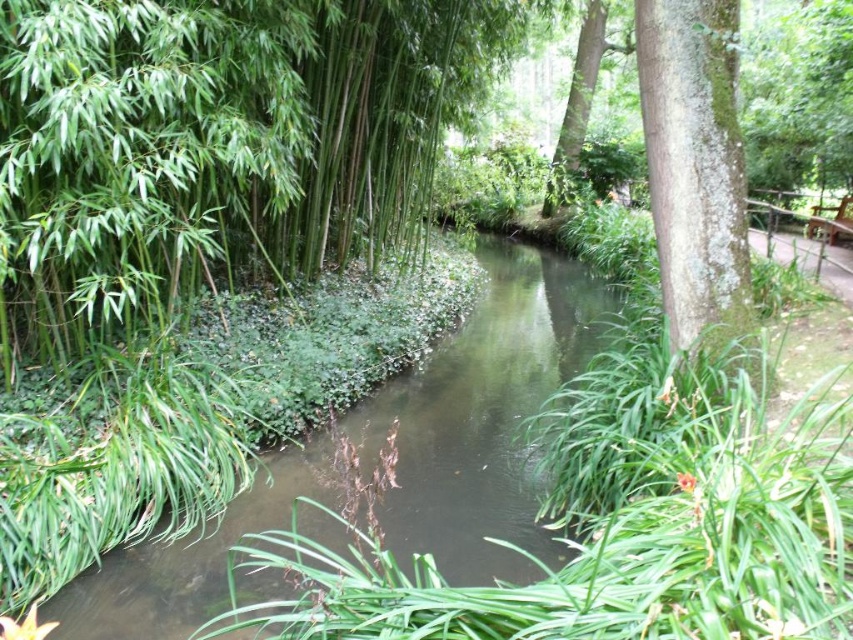
Between point (424, 140) and point (548, 186), which one is positioned in front?

Point (424, 140) is in front.

Which is more to the right, green bamboo at left or green leafy tree at upper center?

From the viewer's perspective, green leafy tree at upper center appears more on the right side.

This screenshot has height=640, width=853. Describe the element at coordinates (216, 145) in the screenshot. I see `green bamboo at left` at that location.

You are a GUI agent. You are given a task and a screenshot of the screen. Output one action in this format:
    pyautogui.click(x=<x>, y=<y>)
    Task: Click on the green bamboo at left
    
    Given the screenshot: What is the action you would take?
    pyautogui.click(x=216, y=145)

Does green bamboo at left have a larger size compared to green leafy stream at center?

Incorrect, green bamboo at left is not larger than green leafy stream at center.

Who is shorter, green bamboo at left or green leafy stream at center?

With less height is green bamboo at left.

Find the location of `green bamboo at left`. green bamboo at left is located at coordinates (216, 145).

In the scene shown: Is green bamboo at left smaller than green mossy bark tree at right?

Yes, green bamboo at left is smaller than green mossy bark tree at right.

Does green bamboo at left lie in front of green mossy bark tree at right?

No, it is behind green mossy bark tree at right.

Who is more forward, (213, 54) or (706, 243)?

Positioned in front is point (706, 243).

Identify the location of green bamboo at left. The height and width of the screenshot is (640, 853). (216, 145).